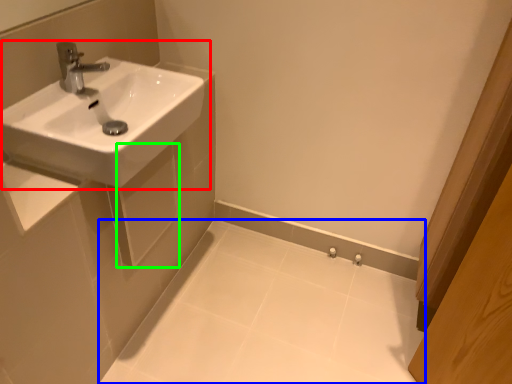
Question: Estimate the real-world distances between objects in this image. Which object is closer to sink (highlighted by a red box), porcelain (highlighted by a blue box) or square (highlighted by a green box)?

Choices:
 (A) porcelain
 (B) square

Answer: (B)